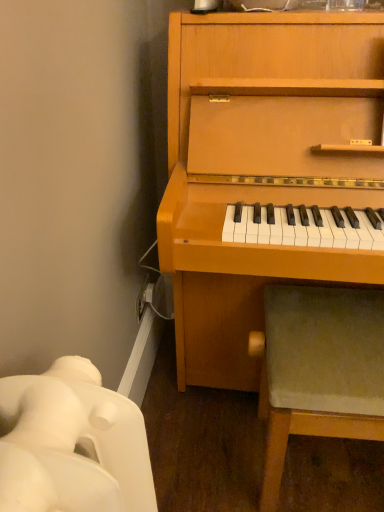
I want to click on velvet green armchair at lower right, so click(x=320, y=370).

The height and width of the screenshot is (512, 384). What do you see at coordinates (320, 370) in the screenshot?
I see `velvet green armchair at lower right` at bounding box center [320, 370].

You are a GUI agent. You are given a task and a screenshot of the screen. Output one action in this format:
    pyautogui.click(x=<x>, y=<y>)
    Task: Click on the velvet green armchair at lower right
    
    Given the screenshot: What is the action you would take?
    pyautogui.click(x=320, y=370)